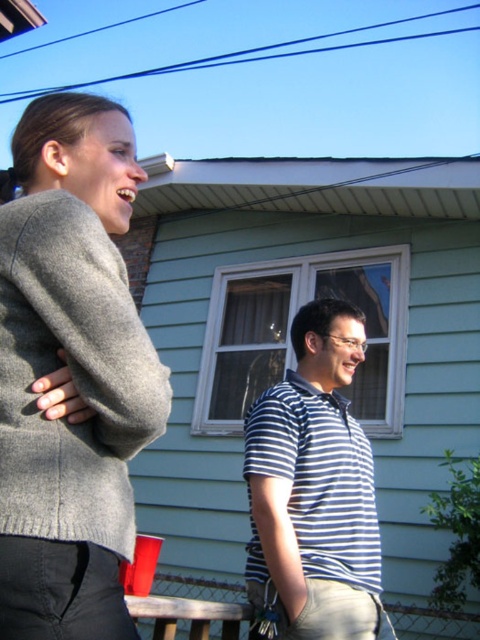
Question: Can you confirm if gray wool sweater at left is thinner than blue striped shirt at center?

Choices:
 (A) no
 (B) yes

Answer: (B)

Question: Which point is farther from the camera taking this photo?

Choices:
 (A) (37, 368)
 (B) (38, 618)
 (C) (316, 490)

Answer: (C)

Question: Does gray wool sweater at upper left appear on the left side of blue striped shirt at center?

Choices:
 (A) no
 (B) yes

Answer: (B)

Question: Is gray wool sweater at left above blue striped shirt at center?

Choices:
 (A) yes
 (B) no

Answer: (A)

Question: Which point is closer to the camera taking this photo?

Choices:
 (A) (61, 320)
 (B) (317, 371)
 (C) (122, 528)

Answer: (A)

Question: Among these points, which one is nearest to the camera?

Choices:
 (A) (349, 321)
 (B) (100, 541)
 (C) (109, 298)

Answer: (B)